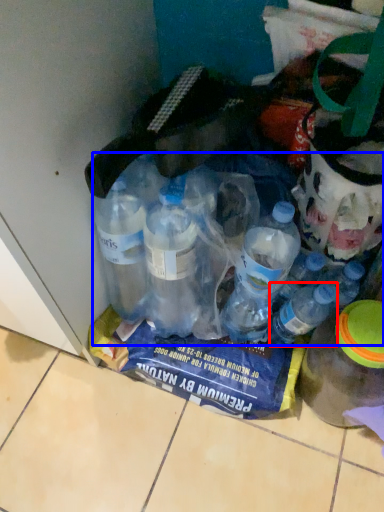
Question: Which of the following is the closest to the observer, bottle (highlighted by a red box) or bottle (highlighted by a blue box)?

Choices:
 (A) bottle
 (B) bottle

Answer: (B)